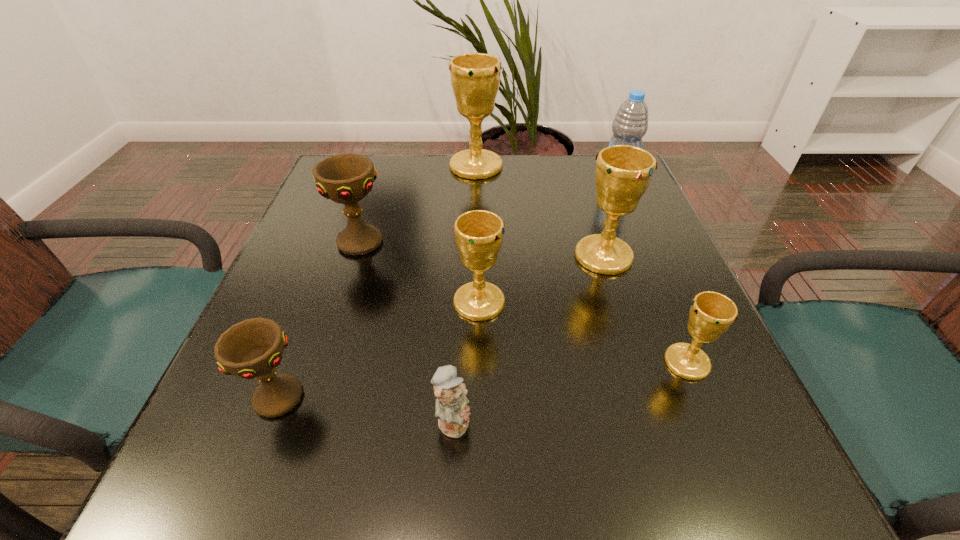
Locate an element on the screen. blue teddy bear is located at coordinates (452, 411).

The height and width of the screenshot is (540, 960). I want to click on teddy bear, so click(452, 411).

I want to click on free space located on the front of the farthest gold chalice, so click(475, 194).

You are a GUI agent. You are given a task and a screenshot of the screen. Output one action in this format:
    pyautogui.click(x=<x>, y=<y>)
    Task: Click on the vacant point located 0.060m on the left of the water bottle
    This screenshot has width=960, height=540.
    Given the screenshot: What is the action you would take?
    pyautogui.click(x=577, y=183)

The width and height of the screenshot is (960, 540). I want to click on free space located 0.050m on the left of the third smallest gold chalice, so click(551, 256).

This screenshot has width=960, height=540. In order to click on free space located 0.300m on the back of the bigger red chalice in this screenshot , I will do `click(385, 160)`.

Identify the location of vacant space located 0.100m on the back of the fifth farthest object. (479, 251).

Locate an element on the screen. The height and width of the screenshot is (540, 960). vacant space positioned 0.370m on the back of the smaller red chalice is located at coordinates (341, 232).

I want to click on free space located 0.250m on the back of the nearest gold chalice, so click(640, 251).

You are a GUI agent. You are given a task and a screenshot of the screen. Output one action in this format:
    pyautogui.click(x=<x>, y=<y>)
    Task: Click on the vacant region located 0.070m on the front-facing side of the shortest object
    The height and width of the screenshot is (540, 960).
    Given the screenshot: What is the action you would take?
    [519, 420]